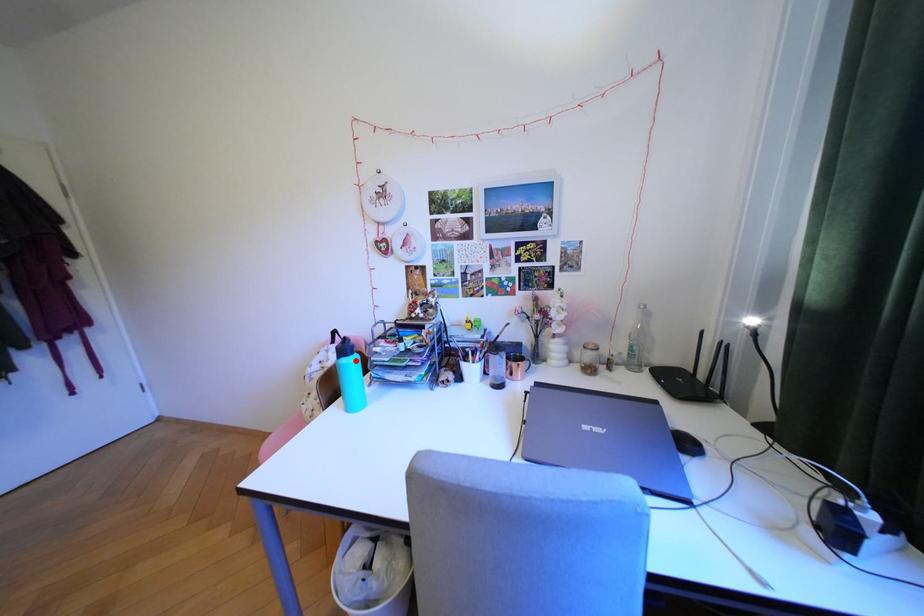
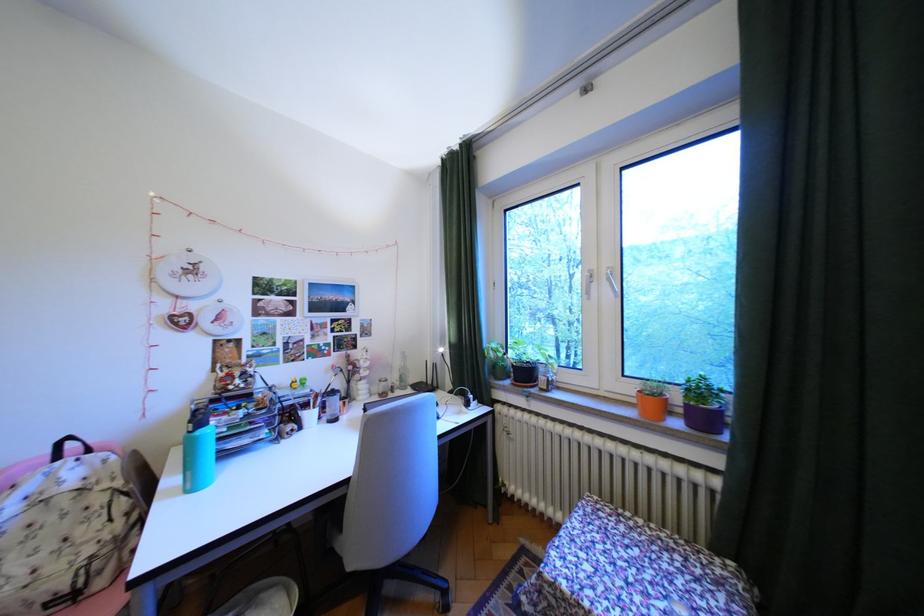
Question: I am providing you with two images of the same scene from different viewpoints. A red point is marked on the first image. Can you still see the location of the red point in image 2?

Choices:
 (A) Yes
 (B) No

Answer: (A)